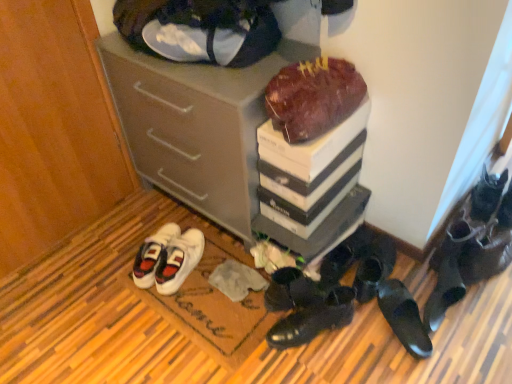
Where is `vacant space in front of black leather shoes at lower right, placed as the 3th footwear when sorted from left to right`? The width and height of the screenshot is (512, 384). vacant space in front of black leather shoes at lower right, placed as the 3th footwear when sorted from left to right is located at coordinates (321, 358).